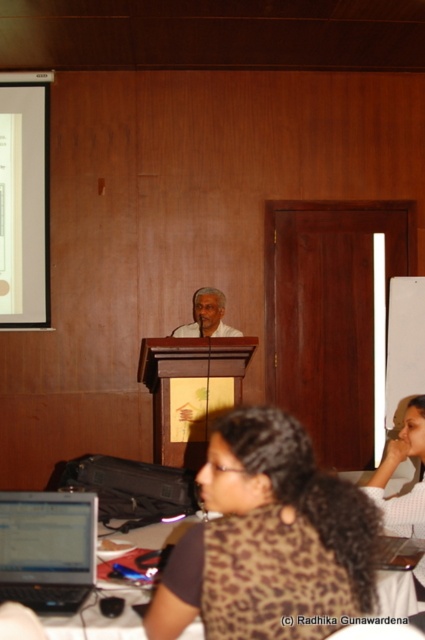
You are standing at the entrance of the conference room and see two points marked in the scene. Which point is closer to you, point (x=232, y=589) or point (x=14, y=81)?

Point (x=232, y=589) is in front of point (x=14, y=81), so it is closer to you.

You are attending a meeting in the conference room and need to present your slides. The screen for the presentation is the white matte speaker at center. However, you notice the brown leopard print shirt at lower right is blocking your view of the screen. Can you adjust your position to see the screen clearly?

The brown leopard print shirt at lower right is in front of the white matte speaker at center, so moving your position to the side or behind the shirt would allow you to see the screen clearly.